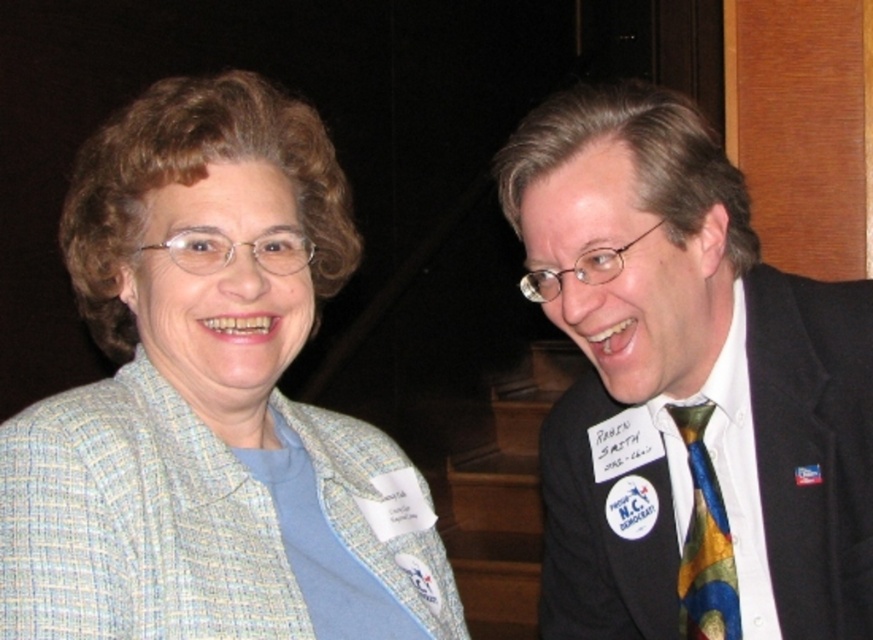
Question: Which of the following is the closest to the observer?

Choices:
 (A) multicolored tie at right
 (B) multicolored silk tie at right

Answer: (A)

Question: Where is multicolored tie at right located in relation to multicolored silk tie at right in the image?

Choices:
 (A) right
 (B) left

Answer: (B)

Question: Among these points, which one is nearest to the camera?

Choices:
 (A) (630, 500)
 (B) (707, 595)

Answer: (B)

Question: Is multicolored tie at right below multicolored silk tie at right?

Choices:
 (A) yes
 (B) no

Answer: (B)

Question: Does multicolored tie at right have a lesser width compared to multicolored silk tie at right?

Choices:
 (A) yes
 (B) no

Answer: (B)

Question: Which point is closer to the camera?

Choices:
 (A) (717, 614)
 (B) (645, 588)

Answer: (A)